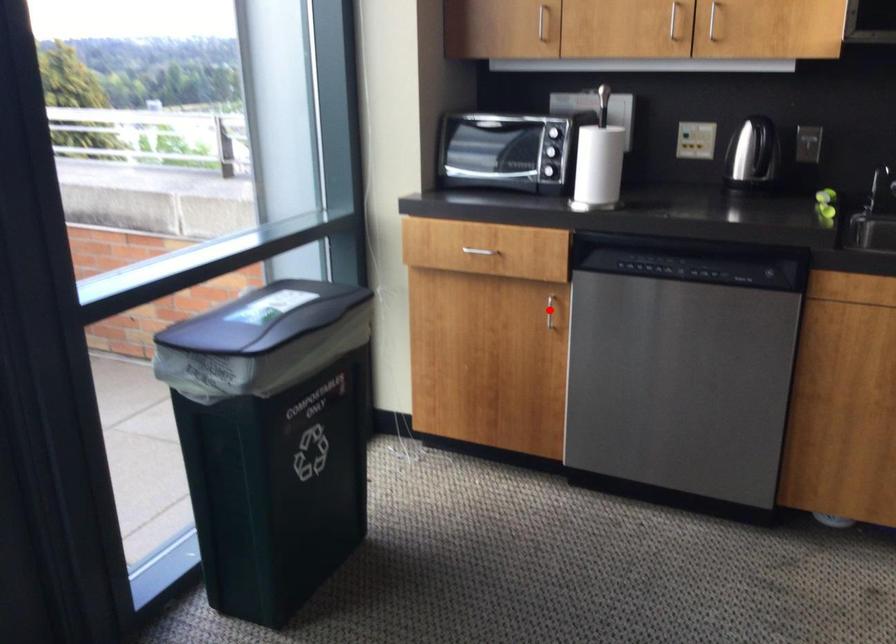
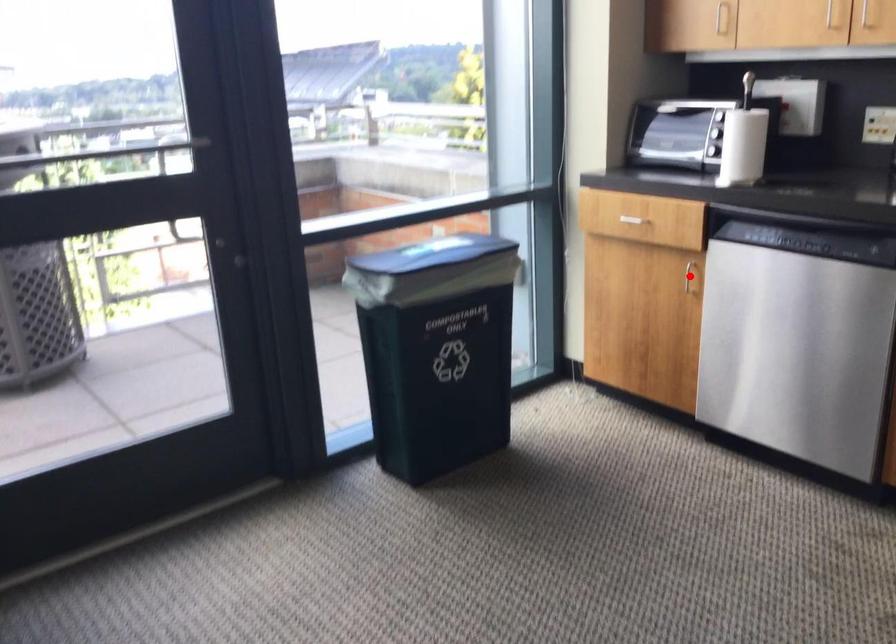
I am providing you with two images of the same scene from different viewpoints. A red point is marked on the first image and another point is marked on the second image. Do the highlighted points in image1 and image2 indicate the same real-world spot?

Yes